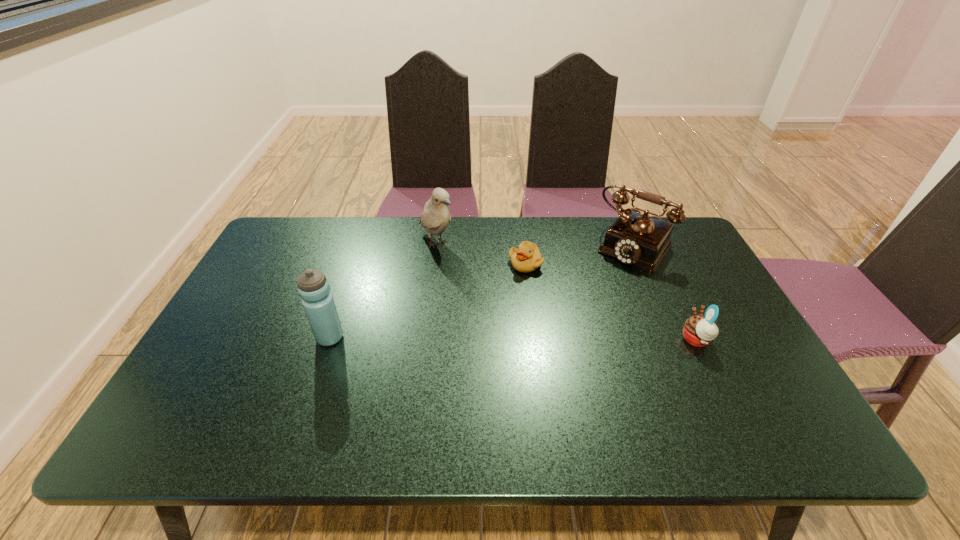
Locate an element on the screen. This screenshot has height=540, width=960. vacant spot on the desktop that is between the water bottle and the muffin and is positioned at the beak of the second object from left to right is located at coordinates (532, 339).

This screenshot has width=960, height=540. Find the location of `free space on the desktop that is between the water bottle and the muffin and is positioned on the front-facing side of the third object from right to left`. free space on the desktop that is between the water bottle and the muffin and is positioned on the front-facing side of the third object from right to left is located at coordinates (486, 339).

At what (x,y) coordinates should I click in order to perform the action: click on vacant space on the desktop that is between the leftmost object and the fourth tallest object and is positioned on the dial of the telephone. Please return your answer as a coordinate pair (x, y). The image size is (960, 540). Looking at the image, I should click on pyautogui.click(x=561, y=339).